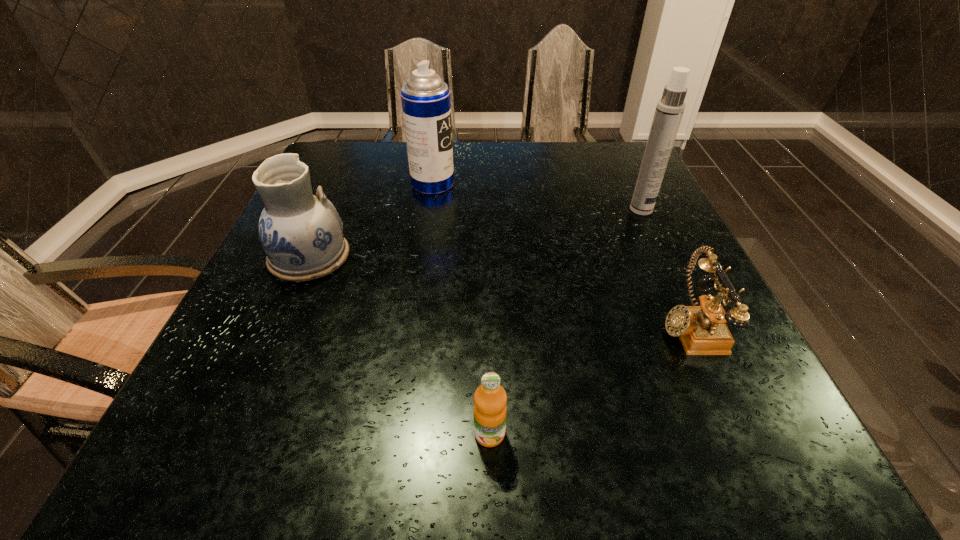
Where is `vacant space positioned on the label side of the left aerosol can`? This screenshot has height=540, width=960. vacant space positioned on the label side of the left aerosol can is located at coordinates (495, 184).

This screenshot has height=540, width=960. In order to click on vacant area situated on the front of the leftmost object in this screenshot , I will do 279,325.

Find the location of a particular element. free space located 0.260m on the dial number of the second nearest object is located at coordinates (521, 325).

Where is `vacant area located 0.310m on the dial number of the second nearest object`? The height and width of the screenshot is (540, 960). vacant area located 0.310m on the dial number of the second nearest object is located at coordinates (494, 325).

Where is `vacant area located on the dial number of the second nearest object`? This screenshot has height=540, width=960. vacant area located on the dial number of the second nearest object is located at coordinates (472, 325).

The image size is (960, 540). Identify the location of object positioned at the far edge. (426, 105).

Where is `object that is at the near edge`? object that is at the near edge is located at coordinates (490, 399).

Locate an element on the screen. The width and height of the screenshot is (960, 540). object that is at the left edge is located at coordinates (302, 235).

At what (x,y) coordinates should I click in order to perform the action: click on aerosol can present at the right edge. Please return your answer as a coordinate pair (x, y). Looking at the image, I should click on (670, 108).

Locate an element on the screen. telephone that is positioned at the right edge is located at coordinates (702, 330).